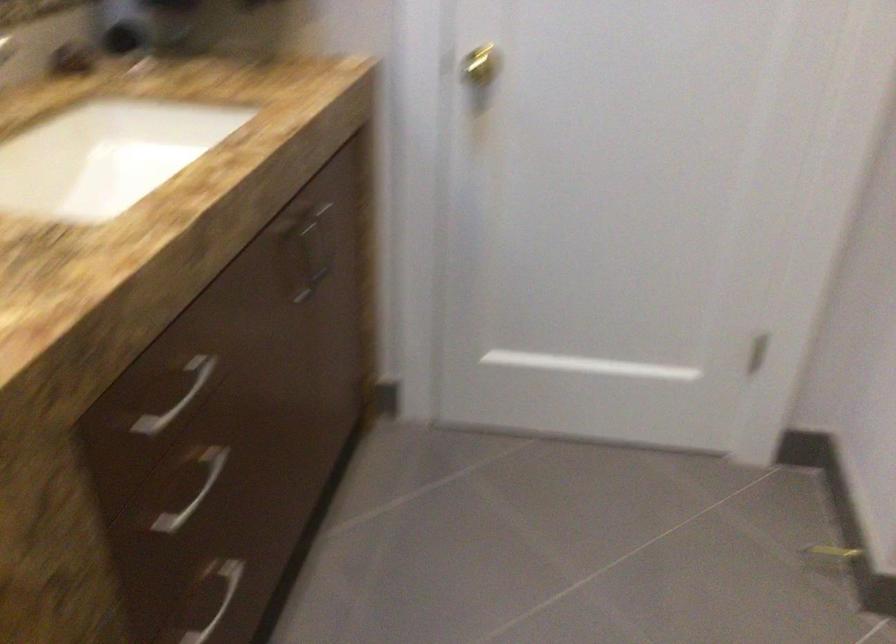
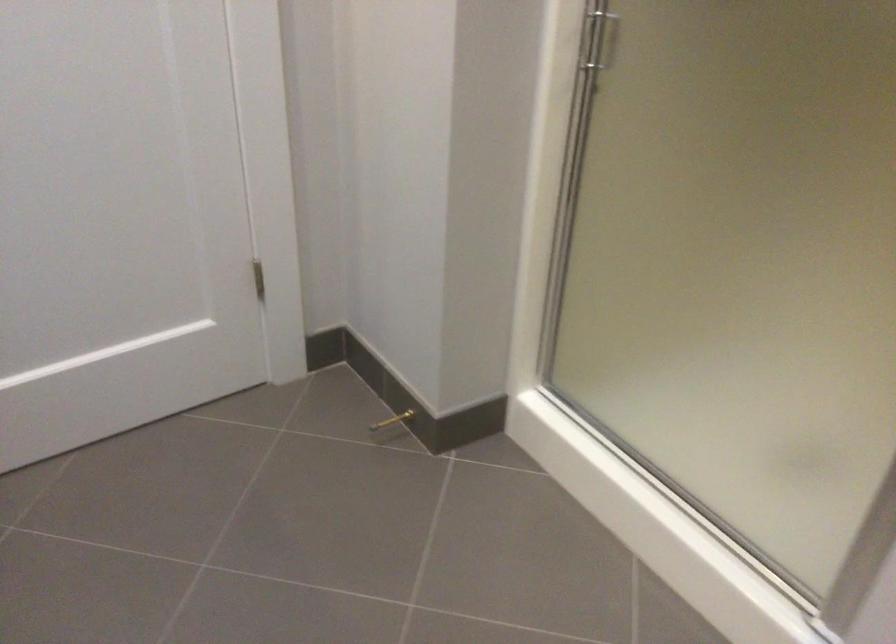
Question: Based on the continuous images, in which direction is the camera rotating? Reply with the corresponding letter.

Choices:
 (A) Left
 (B) Right
 (C) Up
 (D) Down

Answer: (B)